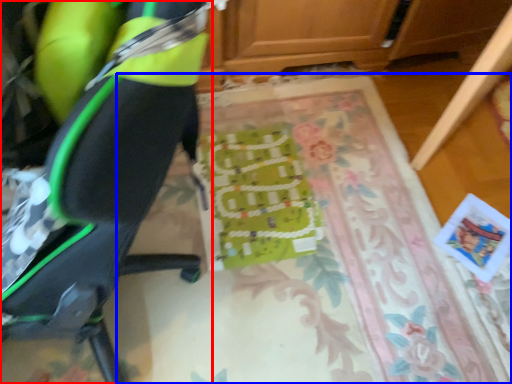
Question: Which object appears closest to the camera in this image, chair (highlighted by a red box) or mat (highlighted by a blue box)?

Choices:
 (A) chair
 (B) mat

Answer: (A)